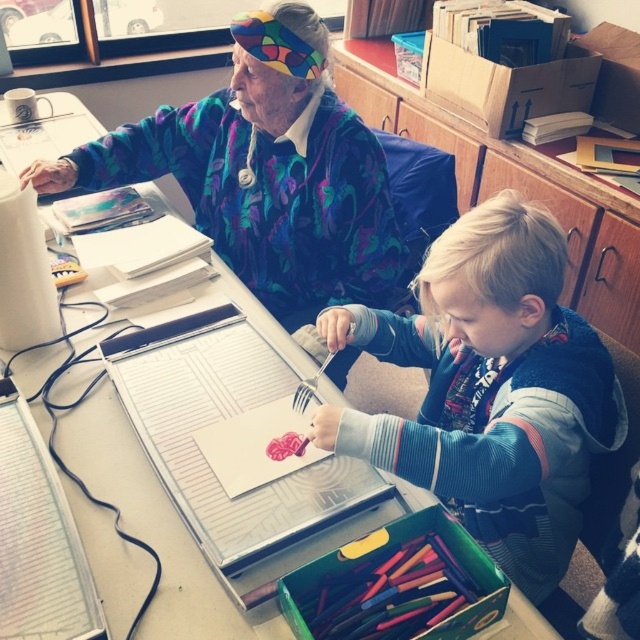
You are an observer looking at the scene. Which item is positioned closer to you, the blue fleece sweater at center or the floral sweater at upper left?

The blue fleece sweater at center is closer to the viewer than the floral sweater at upper left.

What is the spatial relationship between the blue fleece sweater at center and the multicolored wax crayons at lower center?

The blue fleece sweater at center is to the right of the multicolored wax crayons at lower center.

You are a photographer standing in the scene. You want to take a photo of the blue fleece sweater at center without moving any objects. Can you position yourself so that the camera is exactly 33.37 inches away from the sweater?

Yes, since the blue fleece sweater at center and camera are 33.37 inches apart, you can position the camera exactly at that distance to capture the sweater without moving anything.